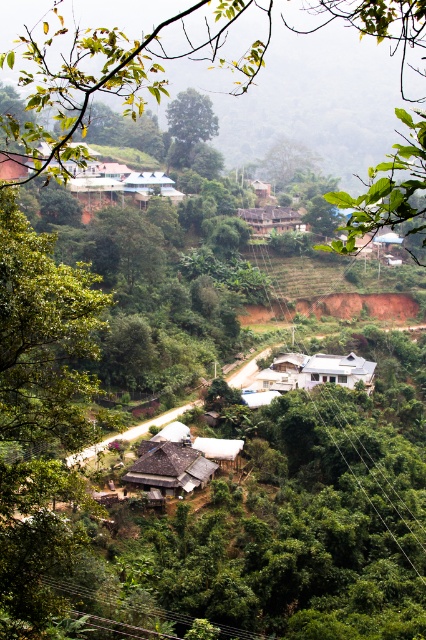
You are standing at the point marked as point (126,60) in the image. What object is located at that point?

The point (126,60) corresponds to the green leafy tree at upper center.

You are a hiker who wants to take a photo of the white corrugated metal hut at center without the green leafy tree at upper center blocking the view. Which direction should you move to get a clear shot?

The green leafy tree at upper center is larger than the white corrugated metal hut at center. To avoid the tree blocking the view, you should move to a position where the tree is out of frame, possibly by moving to the side or further away from the tree.

You are standing at the edge of the dirt road and see the green leafy tree at upper center and the white corrugated metal hut at center. Which object is positioned more to the left side of the scene?

The green leafy tree at upper center is positioned to the left of the white corrugated metal hut at center, so it is more to the left side of the scene.